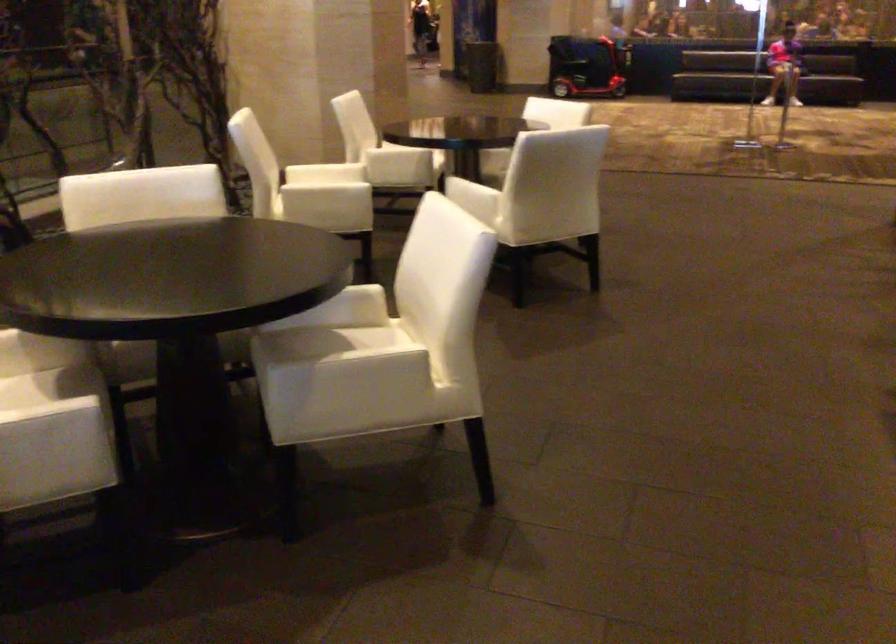
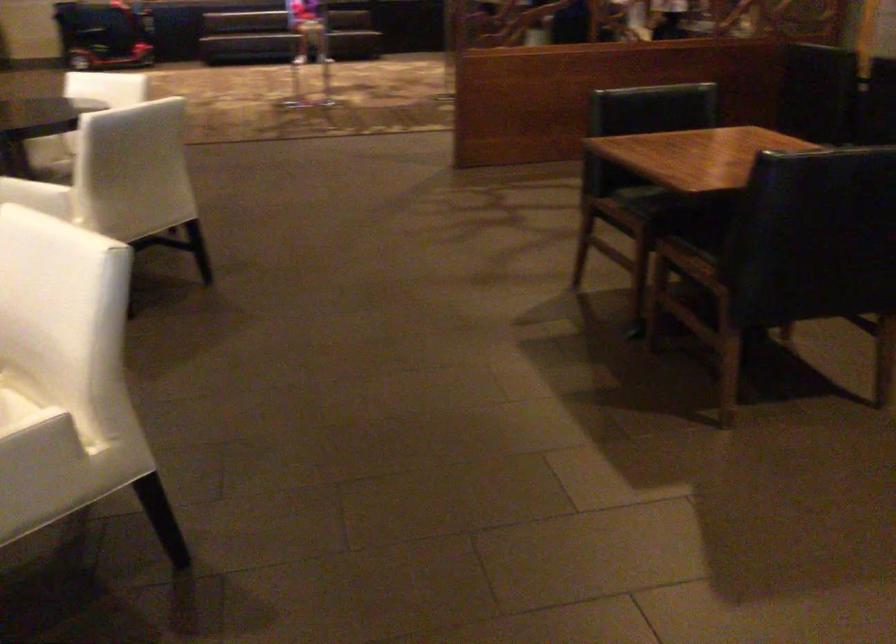
Question: Based on the continuous images, in which direction is the camera rotating? Reply with the corresponding letter.

Choices:
 (A) Left
 (B) Right
 (C) Up
 (D) Down

Answer: (B)